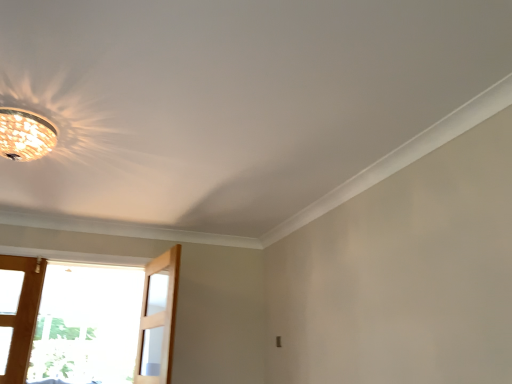
Locate an element on the screen. clear glass screen door at lower left is located at coordinates (158, 318).

What do you see at coordinates (158, 318) in the screenshot? I see `clear glass screen door at lower left` at bounding box center [158, 318].

The image size is (512, 384). What do you see at coordinates (25, 134) in the screenshot? I see `matte glass chandelier at upper left` at bounding box center [25, 134].

Identify the location of matte glass chandelier at upper left. The image size is (512, 384). (25, 134).

Image resolution: width=512 pixels, height=384 pixels. What are the coordinates of `clear glass screen door at lower left` in the screenshot? It's located at (158, 318).

Does matte glass chandelier at upper left appear on the right side of clear glass screen door at lower left?

No.

Which object is further away from the camera, matte glass chandelier at upper left or clear glass screen door at lower left?

clear glass screen door at lower left is more distant.

Which point is more forward, (13, 115) or (174, 274)?

Positioned in front is point (13, 115).

From the image's perspective, is matte glass chandelier at upper left located beneath clear glass screen door at lower left?

No.

From a real-world perspective, which is physically below, matte glass chandelier at upper left or clear glass screen door at lower left?

clear glass screen door at lower left is physically lower.

Considering the sizes of matte glass chandelier at upper left and clear glass screen door at lower left in the image, is matte glass chandelier at upper left wider or thinner than clear glass screen door at lower left?

Clearly, matte glass chandelier at upper left has more width compared to clear glass screen door at lower left.

Considering the sizes of objects matte glass chandelier at upper left and clear glass screen door at lower left in the image provided, who is shorter, matte glass chandelier at upper left or clear glass screen door at lower left?

matte glass chandelier at upper left is shorter.

Considering the relative sizes of matte glass chandelier at upper left and clear glass screen door at lower left in the image provided, is matte glass chandelier at upper left smaller than clear glass screen door at lower left?

Yes.

Is clear glass screen door at lower left inside matte glass chandelier at upper left?

No, clear glass screen door at lower left is not surrounded by matte glass chandelier at upper left.

Is matte glass chandelier at upper left with clear glass screen door at lower left?

No.

Is matte glass chandelier at upper left facing away from clear glass screen door at lower left?

matte glass chandelier at upper left is not turned away from clear glass screen door at lower left.

How many degrees apart are the facing directions of matte glass chandelier at upper left and clear glass screen door at lower left?

matte glass chandelier at upper left and clear glass screen door at lower left are facing 97.3 degrees away from each other.

Measure the distance between matte glass chandelier at upper left and clear glass screen door at lower left.

They are 6.00 feet apart.

The width and height of the screenshot is (512, 384). In order to click on lamp on the left of the clear glass screen door at lower left in this screenshot , I will do `click(25, 134)`.

Considering the relative positions of clear glass screen door at lower left and matte glass chandelier at upper left in the image provided, is clear glass screen door at lower left to the right of matte glass chandelier at upper left from the viewer's perspective?

Yes.

Is clear glass screen door at lower left in front of or behind matte glass chandelier at upper left in the image?

Clearly, clear glass screen door at lower left is behind matte glass chandelier at upper left.

Is point (161, 377) in front of point (8, 137)?

No, (161, 377) is further to viewer.

From the image's perspective, would you say clear glass screen door at lower left is shown under matte glass chandelier at upper left?

Yes, from the image's perspective, clear glass screen door at lower left is beneath matte glass chandelier at upper left.

From a real-world perspective, is clear glass screen door at lower left positioned over matte glass chandelier at upper left based on gravity?

No.

Can you confirm if clear glass screen door at lower left is thinner than matte glass chandelier at upper left?

Indeed, clear glass screen door at lower left has a lesser width compared to matte glass chandelier at upper left.

Which of these two, clear glass screen door at lower left or matte glass chandelier at upper left, stands shorter?

matte glass chandelier at upper left.

Which of these two, clear glass screen door at lower left or matte glass chandelier at upper left, is bigger?

clear glass screen door at lower left is bigger.

Is clear glass screen door at lower left surrounding matte glass chandelier at upper left?

Actually, matte glass chandelier at upper left is outside clear glass screen door at lower left.

Can you see clear glass screen door at lower left touching matte glass chandelier at upper left?

No.

Is clear glass screen door at lower left facing towards matte glass chandelier at upper left?

No, clear glass screen door at lower left does not turn towards matte glass chandelier at upper left.

Can you tell me how much clear glass screen door at lower left and matte glass chandelier at upper left differ in facing direction?

The angular difference between clear glass screen door at lower left and matte glass chandelier at upper left is 97.3 degrees.

Consider the image. Measure the distance between clear glass screen door at lower left and matte glass chandelier at upper left.

6.00 feet.

Locate an element on the screen. Image resolution: width=512 pixels, height=384 pixels. lamp lying on the left of clear glass screen door at lower left is located at coordinates (25, 134).

Locate an element on the screen. The image size is (512, 384). lamp that is on the left side of clear glass screen door at lower left is located at coordinates (25, 134).

This screenshot has width=512, height=384. I want to click on lamp above the clear glass screen door at lower left (from a real-world perspective), so click(x=25, y=134).